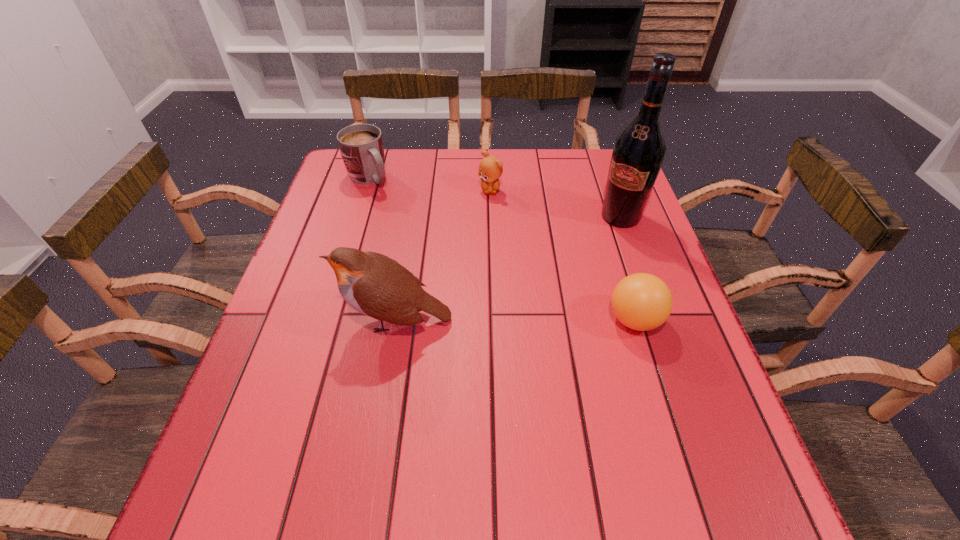
This screenshot has width=960, height=540. I want to click on bird, so click(373, 284).

This screenshot has height=540, width=960. Identify the location of ping-pong ball. (641, 301).

Find the location of a particular element. Image resolution: width=960 pixels, height=540 pixels. the third object from left to right is located at coordinates (490, 168).

Where is `mug`? Image resolution: width=960 pixels, height=540 pixels. mug is located at coordinates (361, 145).

Identify the location of the third nearest object. The image size is (960, 540). (638, 153).

Find the location of a particular element. The image size is (960, 540). wine bottle is located at coordinates (638, 153).

At what (x,y) coordinates should I click in order to perform the action: click on vacant region located 0.060m at the face of the fourth shortest object. Please return your answer as a coordinate pair (x, y). The width and height of the screenshot is (960, 540). Looking at the image, I should click on click(313, 320).

You are a GUI agent. You are given a task and a screenshot of the screen. Output one action in this format:
    pyautogui.click(x=<x>, y=<y>)
    Task: Click on the vacant space located at the face of the fourth shortest object
    Image resolution: width=960 pixels, height=540 pixels.
    Given the screenshot: What is the action you would take?
    pyautogui.click(x=308, y=320)

The image size is (960, 540). I want to click on vacant space located 0.400m on the face of the third object from left to right, so click(x=489, y=302).

In order to click on free point located on the face of the third object from left to right in this screenshot , I will do 489,292.